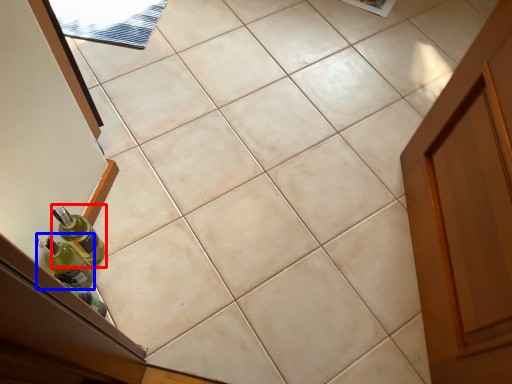
Question: Which of the following is the closest to the observer, bottle (highlighted by a red box) or bottle (highlighted by a blue box)?

Choices:
 (A) bottle
 (B) bottle

Answer: (B)